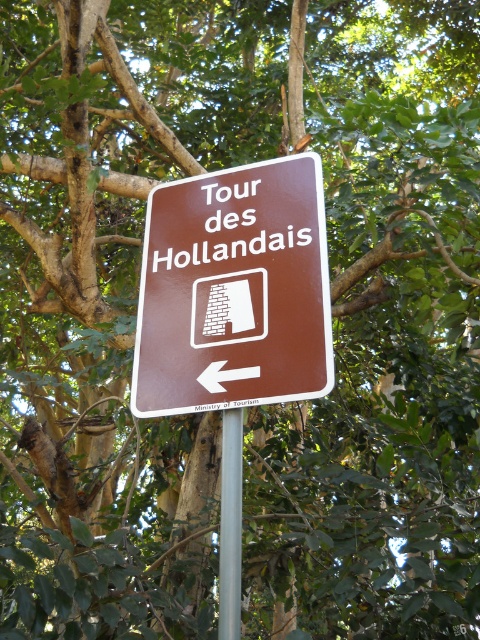
Consider the image. You are a tourist holding a map and looking at the brown matte sign at center and the silver metallic pole at center. Which object is bigger in size?

The brown matte sign at center is larger in size than the silver metallic pole at center.

You are standing in front of the brown matte sign at center and want to touch the silver metallic pole at center. Which direction should you move to reach it?

The silver metallic pole at center is behind the brown matte sign at center, so you should move backward to reach it.